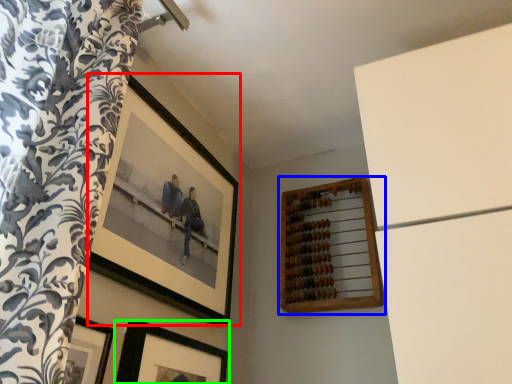
Question: Which object is positioned closest to picture frame (highlighted by a red box)? Select from picture frame (highlighted by a blue box) and picture frame (highlighted by a green box).

Choices:
 (A) picture frame
 (B) picture frame

Answer: (B)